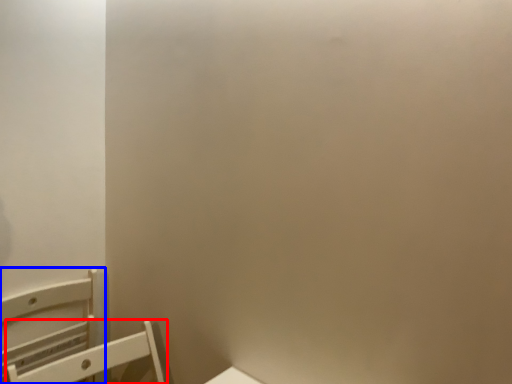
Question: Which object is further to the camera taking this photo, furniture (highlighted by a red box) or furniture (highlighted by a blue box)?

Choices:
 (A) furniture
 (B) furniture

Answer: (B)